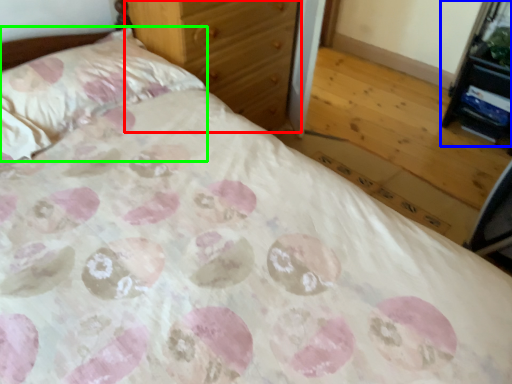
Question: Estimate the real-world distances between objects in this image. Which object is farther from chest of drawers (highlighted by a red box), vanity (highlighted by a blue box) or pillow (highlighted by a green box)?

Choices:
 (A) vanity
 (B) pillow

Answer: (A)